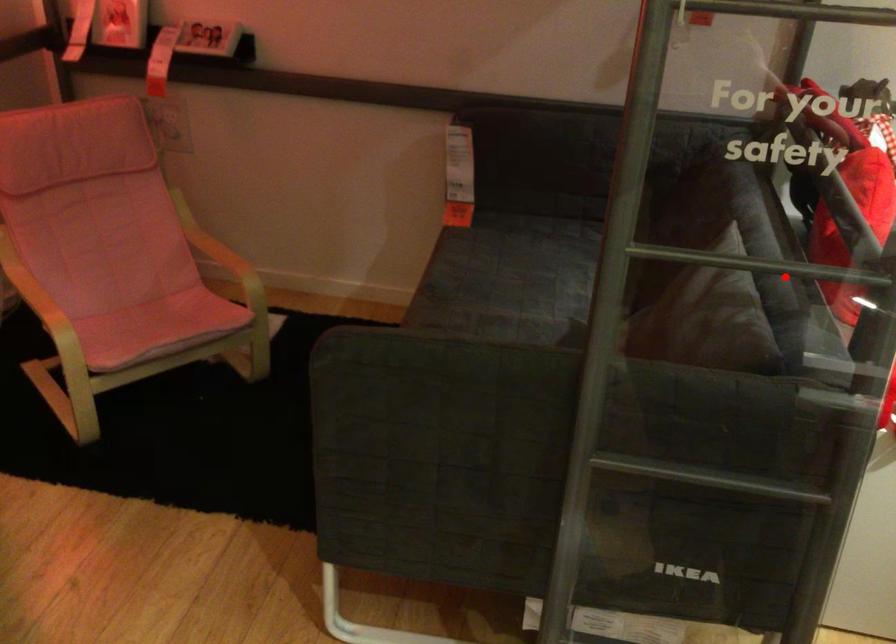
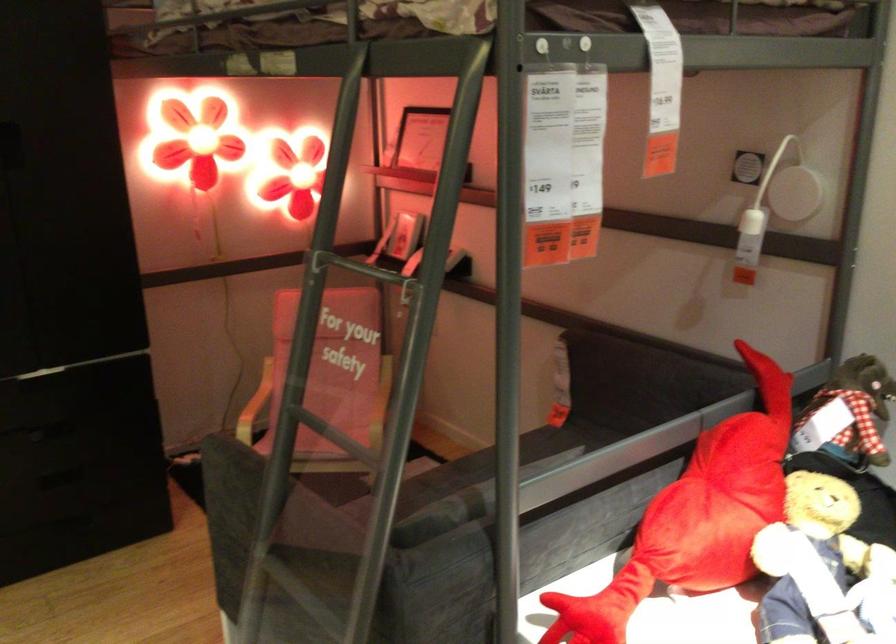
Question: I am providing you with two images of the same scene from different viewpoints. Image1 has a red point marked. In image2, the corresponding 3D location appears at what relative position? Reply with the corresponding letter.

Choices:
 (A) Closer
 (B) Farther

Answer: (B)